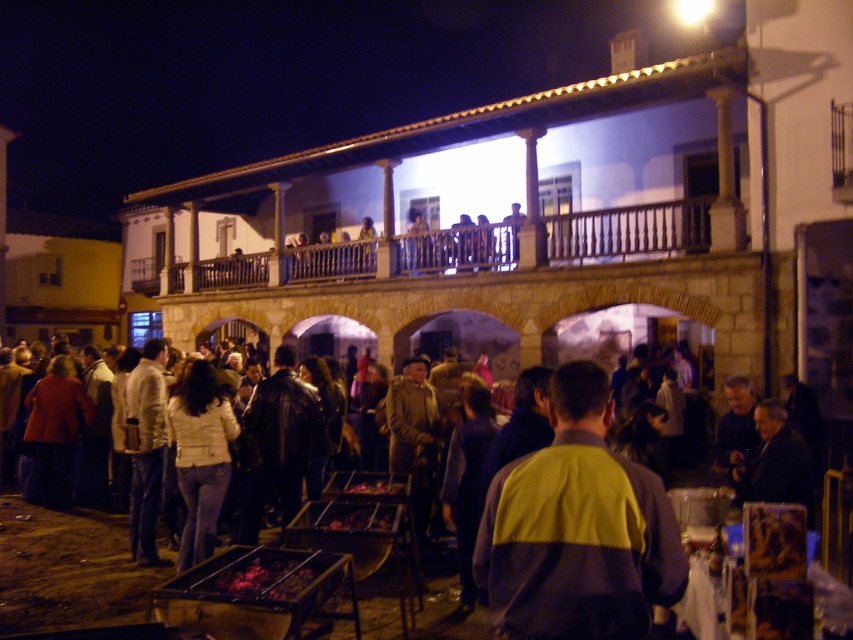
Question: Which point is farther from the camera taking this photo?

Choices:
 (A) (585, 244)
 (B) (424, 580)

Answer: (A)

Question: Does yellow-gray jacket at center have a lesser width compared to brown wooden railing at upper center?

Choices:
 (A) no
 (B) yes

Answer: (B)

Question: Does dark brown leather jacket at center appear under brown wooden railing at upper center?

Choices:
 (A) yes
 (B) no

Answer: (A)

Question: Estimate the real-world distances between objects in this image. Which object is farther from the brown wooden railing at upper center?

Choices:
 (A) yellow-gray jacket at center
 (B) dark brown leather jacket at center

Answer: (A)

Question: Which object is positioned closest to the yellow-gray jacket at center?

Choices:
 (A) brown wooden railing at upper center
 (B) dark brown leather jacket at center

Answer: (B)

Question: Where is yellow-gray jacket at center located in relation to brown wooden railing at upper center in the image?

Choices:
 (A) above
 (B) below

Answer: (B)